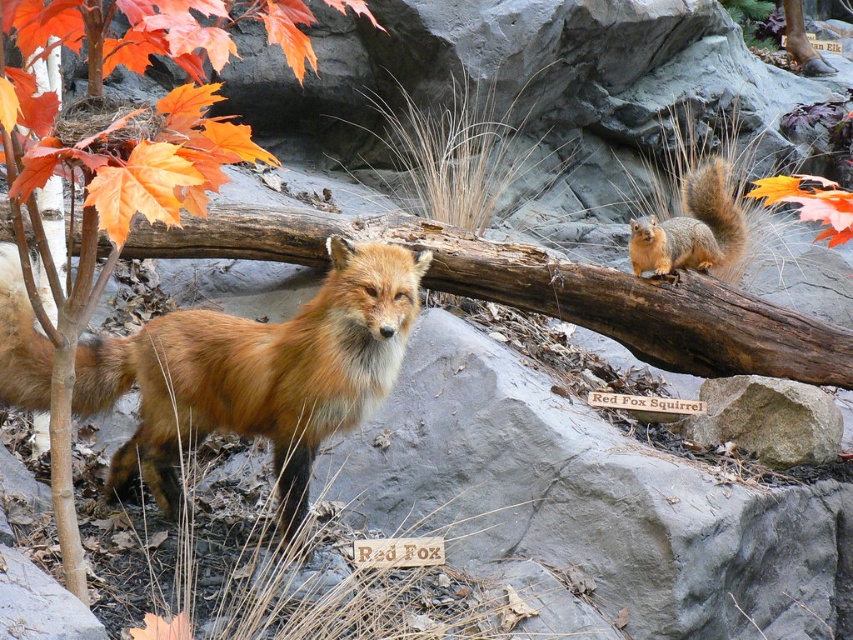
Can you confirm if fuzzy brown tail at lower left is smaller than orange matte maple leaf at upper right?

Actually, fuzzy brown tail at lower left might be larger than orange matte maple leaf at upper right.

Is fuzzy brown tail at lower left positioned before orange matte maple leaf at upper right?

No.

Does point (12, 388) come closer to viewer compared to point (779, 184)?

That is False.

The image size is (853, 640). Identify the location of fuzzy brown tail at lower left. [20, 340].

The width and height of the screenshot is (853, 640). Identify the location of shiny reddish-brown fur at center. (258, 374).

Is shiny reddish-brown fur at center to the left of orange matte maple leaf at upper right from the viewer's perspective?

Correct, you'll find shiny reddish-brown fur at center to the left of orange matte maple leaf at upper right.

The height and width of the screenshot is (640, 853). What do you see at coordinates (258, 374) in the screenshot?
I see `shiny reddish-brown fur at center` at bounding box center [258, 374].

At what (x,y) coordinates should I click in order to perform the action: click on shiny reddish-brown fur at center. Please return your answer as a coordinate pair (x, y). The height and width of the screenshot is (640, 853). Looking at the image, I should click on (258, 374).

Which is more to the left, shiny reddish-brown fur at center or orange matte leaf at upper left?

Positioned to the left is shiny reddish-brown fur at center.

The height and width of the screenshot is (640, 853). What are the coordinates of `shiny reddish-brown fur at center` in the screenshot? It's located at (258, 374).